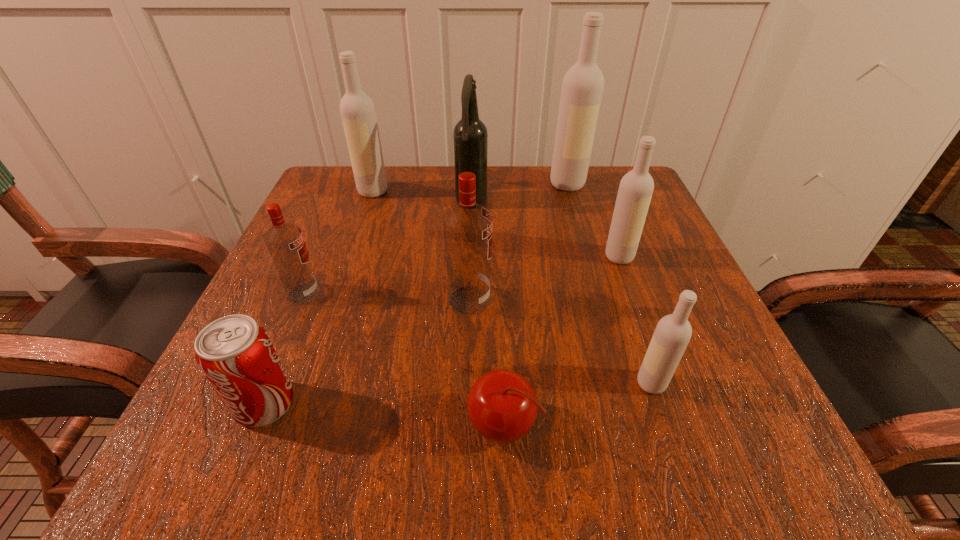
The width and height of the screenshot is (960, 540). Identify the location of free spot located on the back of the nearest vodka. (624, 303).

What are the coordinates of `vacant space located 0.200m on the back of the red soda can` in the screenshot? It's located at (314, 285).

Where is `vacant space located 0.210m on the left of the shortest object`? vacant space located 0.210m on the left of the shortest object is located at coordinates [309, 426].

At what (x,y) coordinates should I click in order to perform the action: click on beer bottle present at the far edge. Please return your answer as a coordinate pair (x, y). This screenshot has width=960, height=540. Looking at the image, I should click on (470, 137).

Find the location of a particular element. The height and width of the screenshot is (540, 960). soda can that is positioned at the near edge is located at coordinates (235, 353).

Locate an element on the screen. This screenshot has height=540, width=960. cherry present at the near edge is located at coordinates (502, 406).

Locate an element on the screen. This screenshot has width=960, height=540. soda can present at the left edge is located at coordinates (235, 353).

Where is `object located in the far left corner section of the desktop`? The height and width of the screenshot is (540, 960). object located in the far left corner section of the desktop is located at coordinates (357, 110).

Identify the location of object situated at the near left corner. (235, 353).

Locate an element on the screen. object that is at the far right corner is located at coordinates (582, 88).